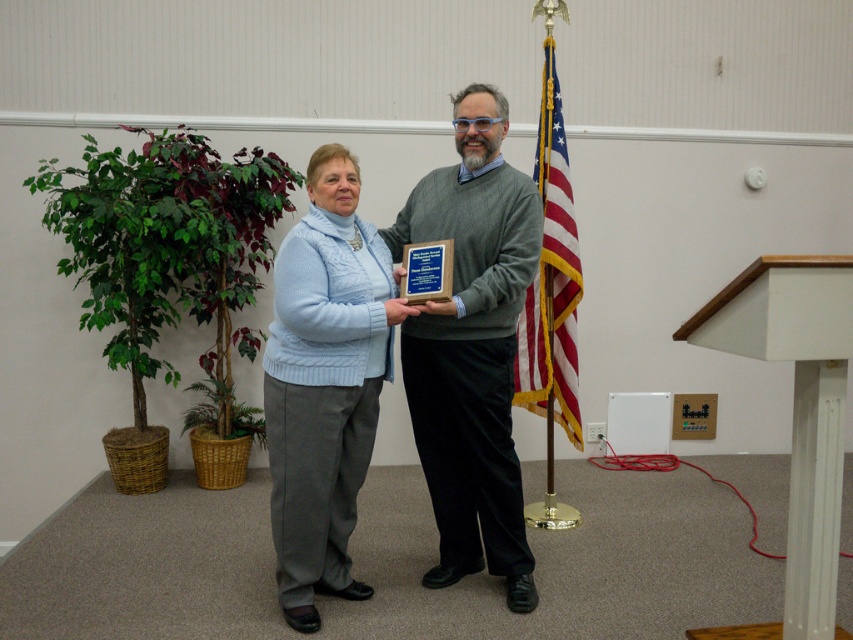
You are an interior designer planning the layout of a room. You need to place a new sofa that will be positioned to the right of the light blue sweater at center. Where should you place the sofa relative to the flagpole?

The light blue sweater at center is located at point (323, 384), so the sofa should be placed to the right of this coordinate, ensuring it is positioned appropriately relative to the flagpole.

You are a photographer setting up for a group photo. You need to ensure that the matte gray sweater at center and the white glossy podium at center are both in frame. Given that your camera has a maximum focus range of 30 inches, will you be able to capture both objects clearly in the same shot?

The distance between the matte gray sweater at center and the white glossy podium at center is 32.86 inches, which exceeds the camera maximum focus range of 30 inches. Therefore, you cannot capture both objects clearly in the same shot.

You are organizing a small event and need to place a 1.2 meter wide banner between the matte gray sweater at center and the white glossy podium at center. Can the banner fit in the space between them?

The matte gray sweater at center occupies less space than the white glossy podium at center, but the description does not provide specific measurements of the distance between them. Therefore, it is unclear if the banner will fit.